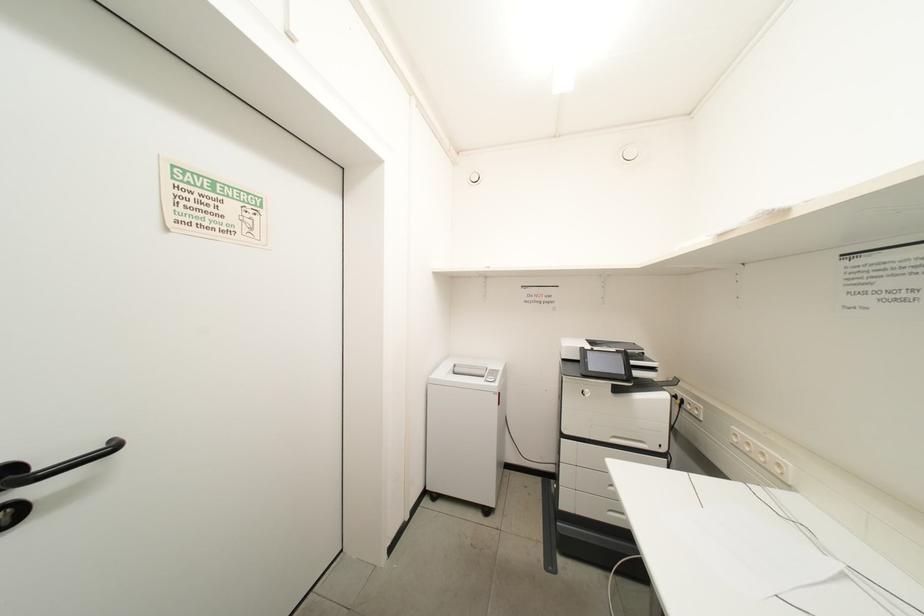
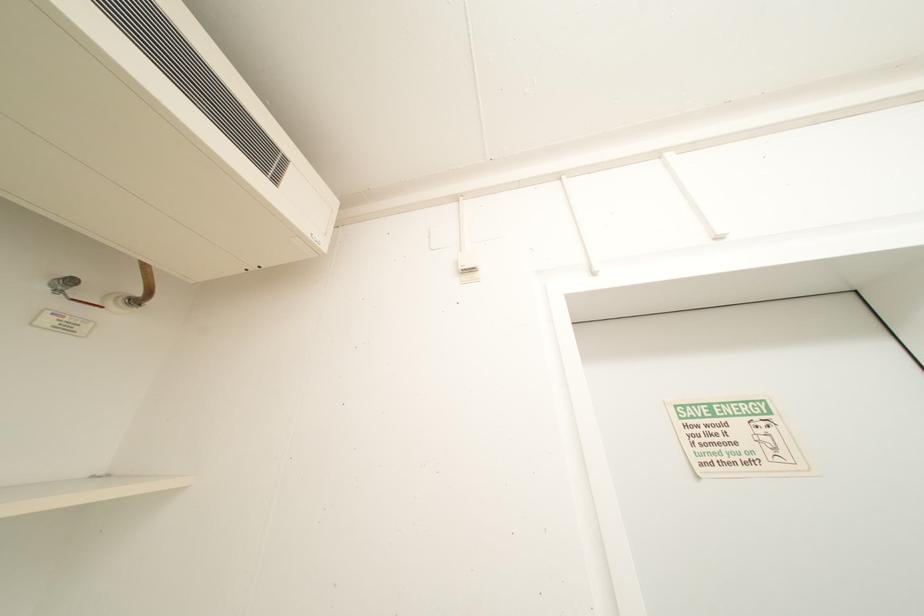
Consider the image. First-person continuous shooting, in which direction is the camera rotating?

The rotation direction of the camera is left-up.